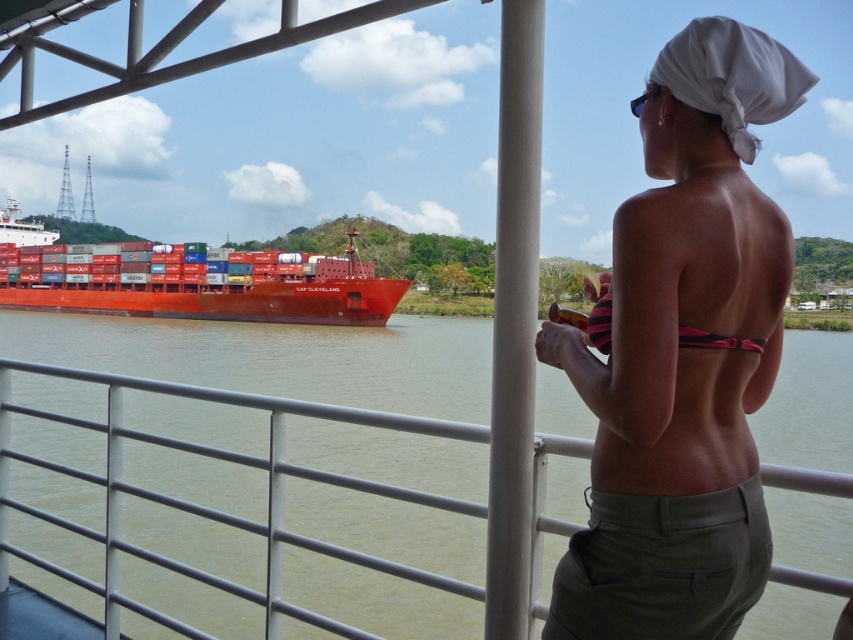
Question: Can you confirm if green water at lower left is positioned below matte red container ship at left?

Choices:
 (A) no
 (B) yes

Answer: (B)

Question: Does green water at lower left lie in front of matte red container ship at left?

Choices:
 (A) no
 (B) yes

Answer: (B)

Question: Which object is the closest to the pink fabric bikini at center?

Choices:
 (A) pink striped bikini top at back
 (B) green water at lower left

Answer: (A)

Question: Can you confirm if green water at lower left is positioned to the right of matte red container ship at left?

Choices:
 (A) no
 (B) yes

Answer: (B)

Question: Which object appears farthest from the camera in this image?

Choices:
 (A) pink fabric bikini at center
 (B) pink striped bikini top at back
 (C) green water at lower left

Answer: (C)

Question: Which of the following is the closest to the observer?

Choices:
 (A) (714, 83)
 (B) (334, 307)
 (C) (350, 397)

Answer: (A)